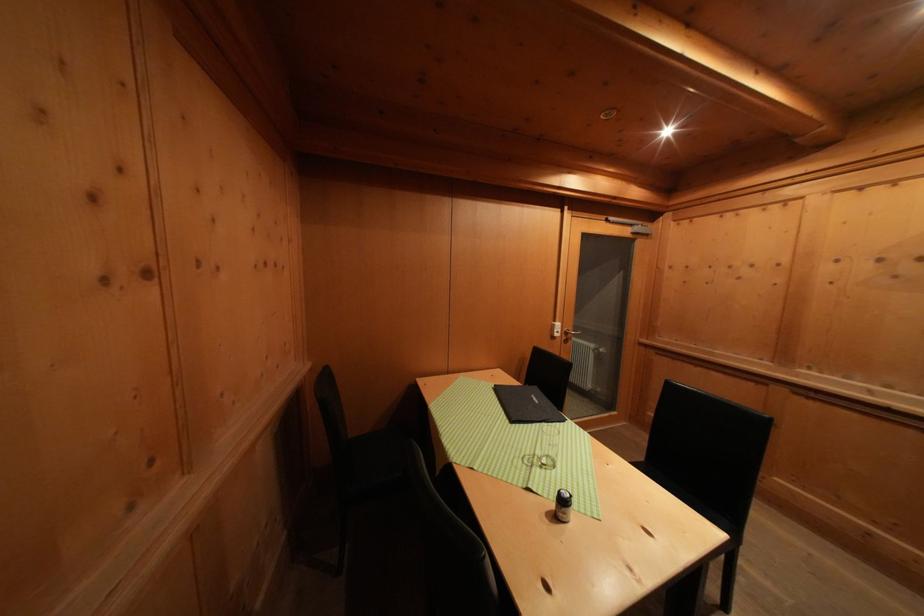
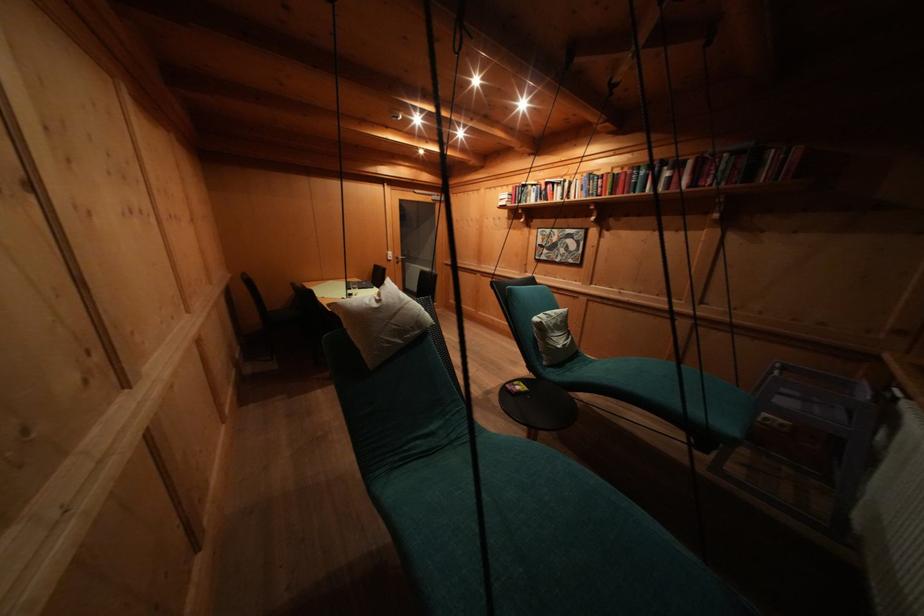
Question: What movement of the cameraman would produce the second image?

Choices:
 (A) Left
 (B) Right
 (C) Forward
 (D) Backward

Answer: (D)